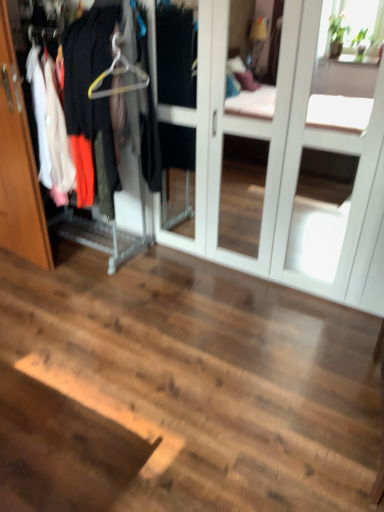
I want to click on free spot to the right of metallic hanger at left, so click(x=176, y=271).